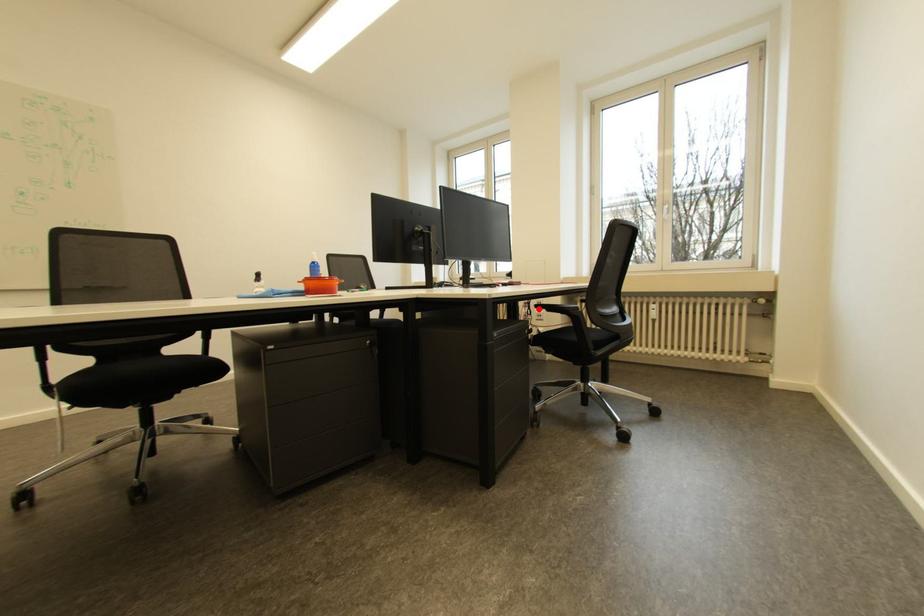
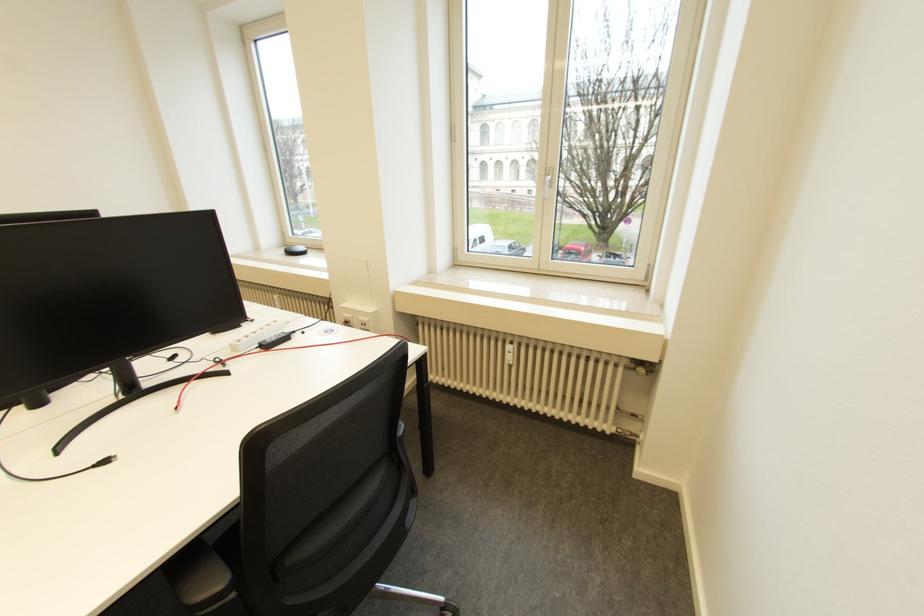
Question: I am providing you with two images of the same scene from different viewpoints. A red point is marked on the first image. Is the red point's position out of view in image 2?

Choices:
 (A) Yes
 (B) No

Answer: (A)